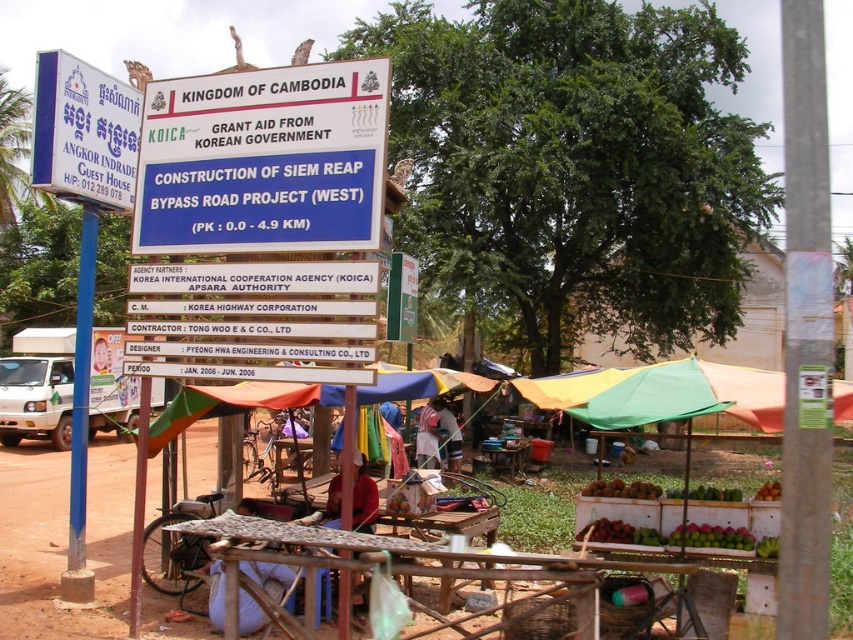
Does blue plastic sign at upper center appear under white plastic sign at upper left?

Yes.

Who is positioned more to the left, blue plastic sign at upper center or white plastic sign at upper left?

Positioned to the left is white plastic sign at upper left.

Where is `blue plastic sign at upper center`? Image resolution: width=853 pixels, height=640 pixels. blue plastic sign at upper center is located at coordinates (263, 161).

Is point (378, 200) closer to camera compared to point (77, 451)?

Yes.

Who is higher up, blue plastic sign at upper center or blue painted metal pole at left?

Positioned higher is blue plastic sign at upper center.

Image resolution: width=853 pixels, height=640 pixels. Describe the element at coordinates (263, 161) in the screenshot. I see `blue plastic sign at upper center` at that location.

Locate an element on the screen. blue plastic sign at upper center is located at coordinates (263, 161).

Does point (235, 224) lie behind point (413, 276)?

No, (235, 224) is closer to viewer.

Does blue plastic sign at upper center have a greater width compared to white plastic sign at center?

Indeed, blue plastic sign at upper center has a greater width compared to white plastic sign at center.

This screenshot has width=853, height=640. I want to click on blue plastic sign at upper center, so click(263, 161).